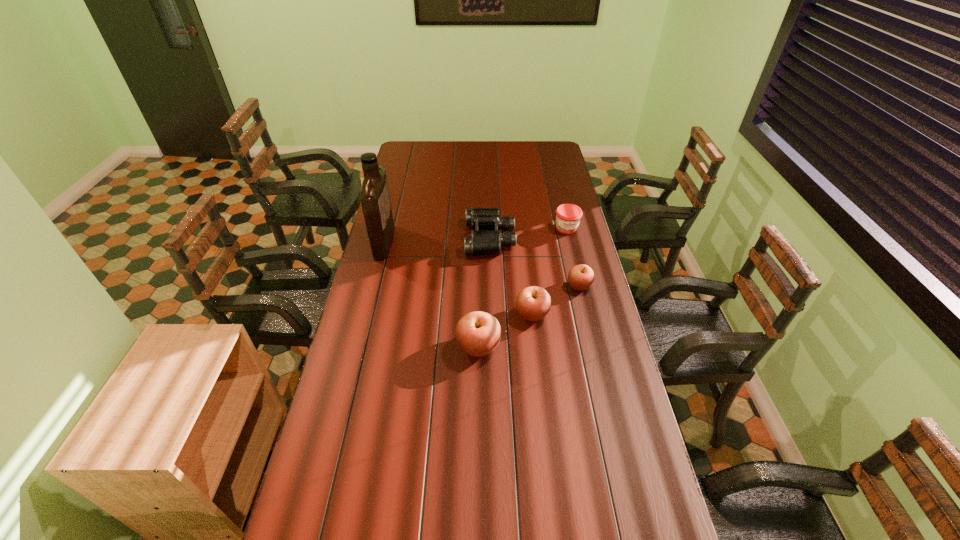
Locate an element on the screen. The height and width of the screenshot is (540, 960). vacant area that lies between the tallest object and the binoculars is located at coordinates (437, 240).

Locate an element on the screen. The width and height of the screenshot is (960, 540). free space between the fifth shortest object and the jam is located at coordinates (522, 288).

The height and width of the screenshot is (540, 960). Identify the location of empty location between the liquor and the second tallest apple. (458, 278).

The height and width of the screenshot is (540, 960). Identify the location of the third closest object relative to the third nearest object. (568, 216).

Identify which object is located as the third nearest to the rightmost apple. Please provide its 2D coordinates. Your answer should be formatted as a tuple, i.e. [(x, y)], where the tuple contains the x and y coordinates of a point satisfying the conditions above.

[(568, 216)]

Locate an element on the screen. The width and height of the screenshot is (960, 540). the second closest apple to the nearest apple is located at coordinates (580, 277).

Point out which apple is positioned as the nearest to the binoculars. Please provide its 2D coordinates. Your answer should be formatted as a tuple, i.e. [(x, y)], where the tuple contains the x and y coordinates of a point satisfying the conditions above.

[(580, 277)]

The width and height of the screenshot is (960, 540). Find the location of `vacant area in the image that satisfies the following two spatial constraints: 1. on the front-facing side of the binoculars; 2. on the right side of the second tallest apple`. vacant area in the image that satisfies the following two spatial constraints: 1. on the front-facing side of the binoculars; 2. on the right side of the second tallest apple is located at coordinates (492, 314).

Image resolution: width=960 pixels, height=540 pixels. What are the coordinates of `free spot that satisfies the following two spatial constraints: 1. on the front-facing side of the binoculars; 2. on the right side of the second nearest object` in the screenshot? It's located at (492, 314).

At what (x,y) coordinates should I click in order to perform the action: click on free region that satisfies the following two spatial constraints: 1. on the label side of the leftmost object; 2. on the left side of the second apple from left to right. Please return your answer as a coordinate pair (x, y). Looking at the image, I should click on (366, 314).